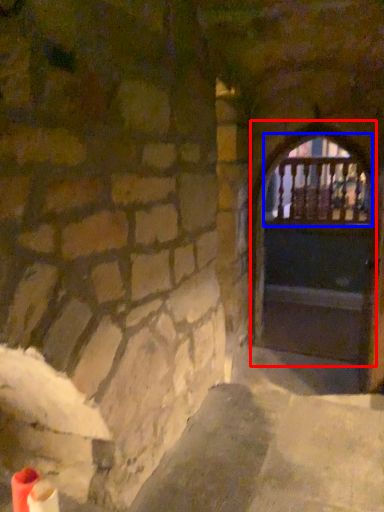
Question: Among these objects, which one is nearest to the camera, door (highlighted by a red box) or window (highlighted by a blue box)?

Choices:
 (A) door
 (B) window

Answer: (A)